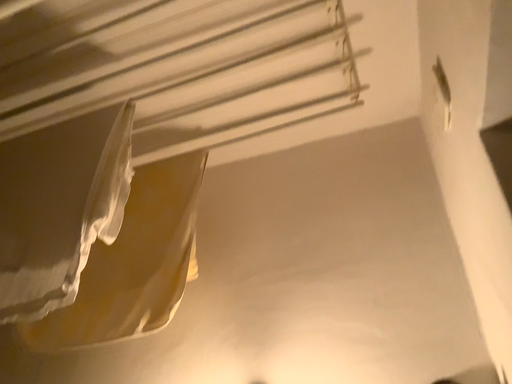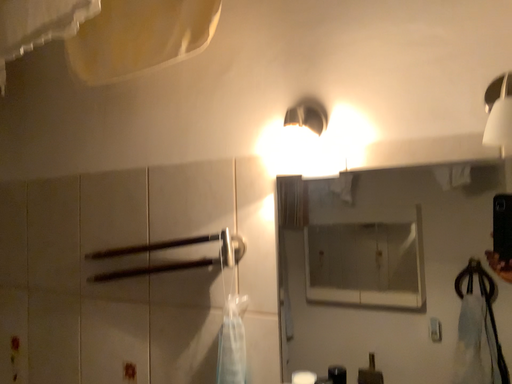
Question: How did the camera likely rotate when shooting the video?

Choices:
 (A) rotated downward
 (B) rotated upward

Answer: (A)